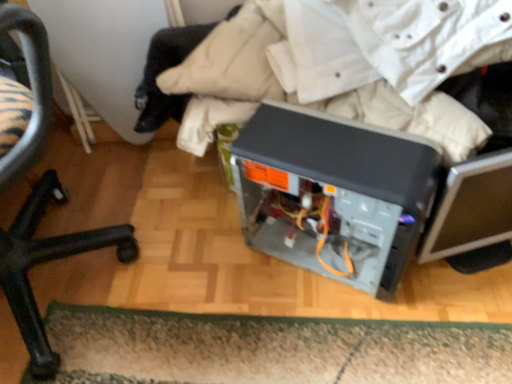
I want to click on vacant area that lies between satin black computer case at center and green shaggy doormat at lower center, so click(244, 283).